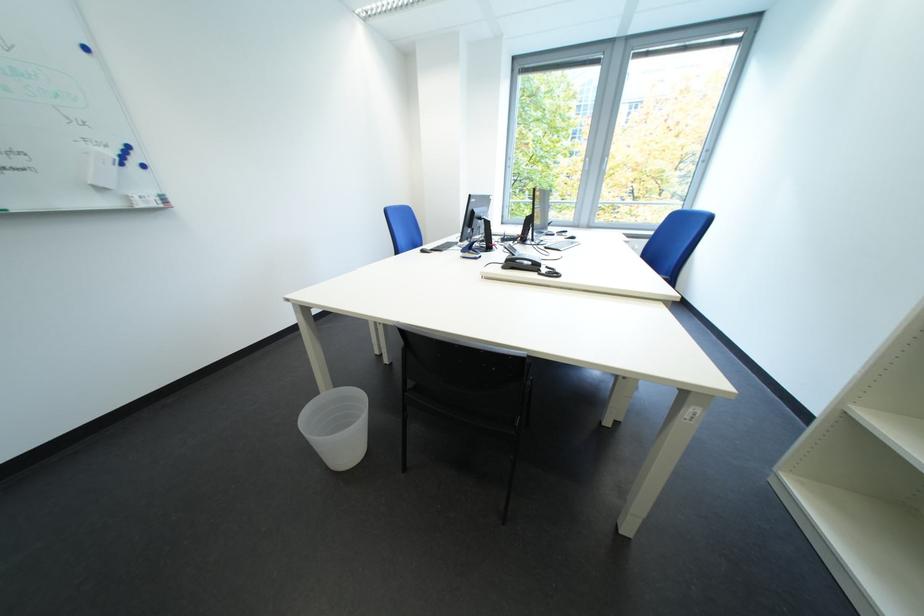
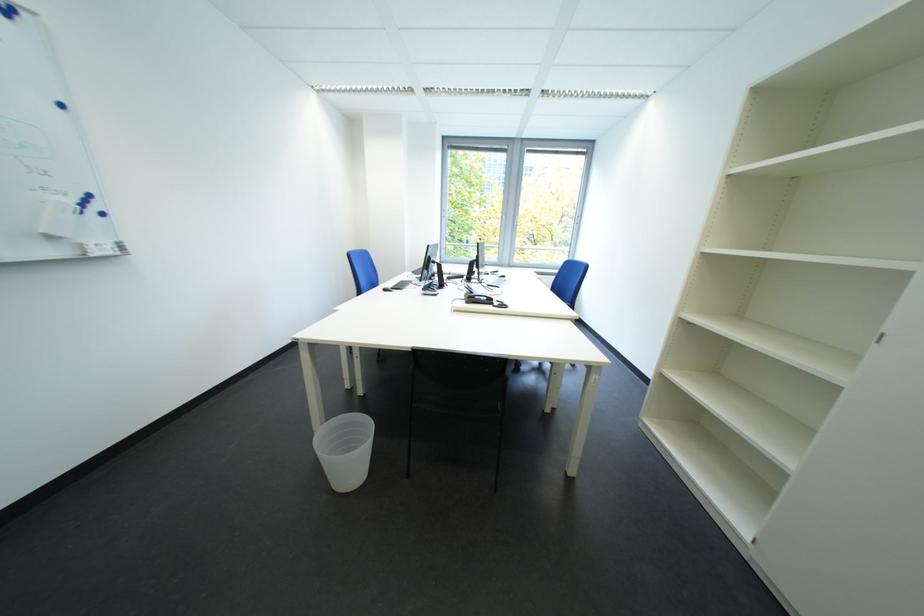
Locate, in the second image, the point that corresponds to (427,248) in the first image.

(385, 286)